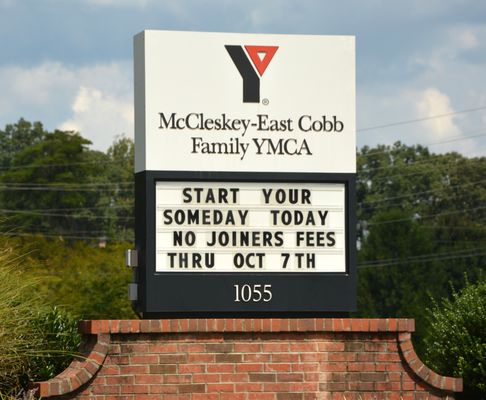
Find the location of a particular element. Image resolution: width=486 pixels, height=400 pixels. brick wall is located at coordinates (337, 368).